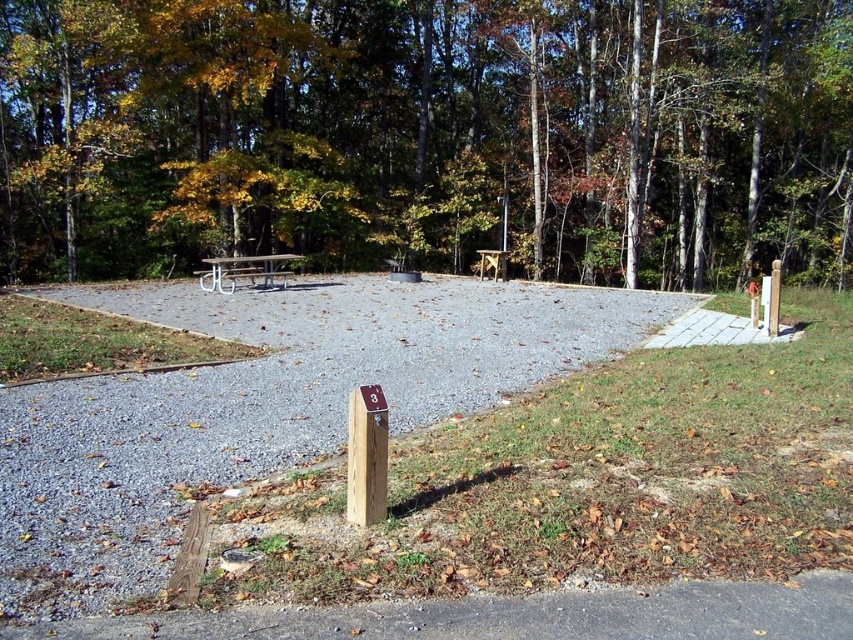
Question: Does brown wood tree at upper center come in front of white concrete path at right?

Choices:
 (A) yes
 (B) no

Answer: (B)

Question: Which point appears closest to the camera in this image?

Choices:
 (A) (566, 49)
 (B) (223, 269)

Answer: (B)

Question: Which point appears farthest from the camera in this image?

Choices:
 (A) (763, 337)
 (B) (814, 577)

Answer: (A)

Question: Is brown wood tree at upper center to the right of white concrete path at right from the viewer's perspective?

Choices:
 (A) no
 (B) yes

Answer: (A)

Question: Does metallic silver picnic table at center have a smaller size compared to white plastic bench at center?

Choices:
 (A) no
 (B) yes

Answer: (A)

Question: Which point is farther from the camera taking this photo?

Choices:
 (A) (305, 305)
 (B) (670, 342)
 (C) (228, 280)
 (D) (740, 600)

Answer: (C)